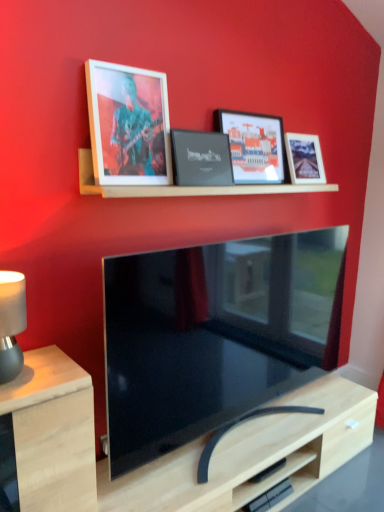
This screenshot has width=384, height=512. Find the location of `vacant space behind matte black lampshade at left`. vacant space behind matte black lampshade at left is located at coordinates (40, 354).